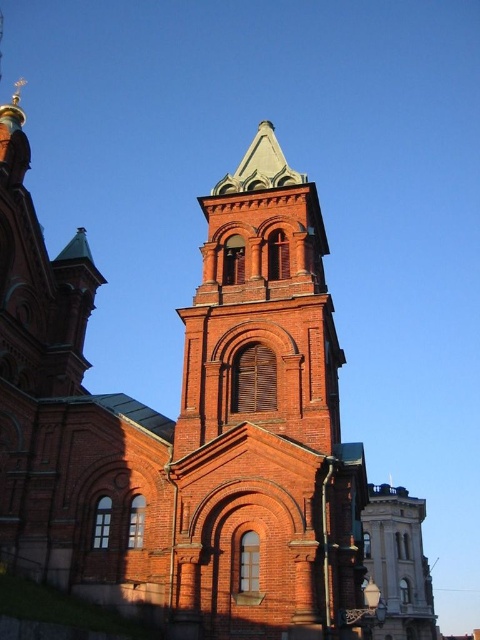
You are a drone operator tasked with capturing aerial footage of the church. The drone has a maximum flight range of 30 meters. If you are positioned at the red brick tower at center, can you safely fly the drone to the smooth gray stone tower at center without exceeding its range?

The red brick tower at center and smooth gray stone tower at center are 29.47 meters apart from each other. Since the drone has a maximum flight range of 30 meters, the distance between them is within the drone operator can safely fly the drone from the red brick tower at center to the smooth gray stone tower at center without exceeding the range.

You are standing in front of two towers in the image. The red brick tower at center and the smooth gray stone tower at center. Which tower do you see first as you approach the structure?

The red brick tower at center is closer to the viewer than the smooth gray stone tower at center, so you would see the red brick tower at center first as you approach the structure.